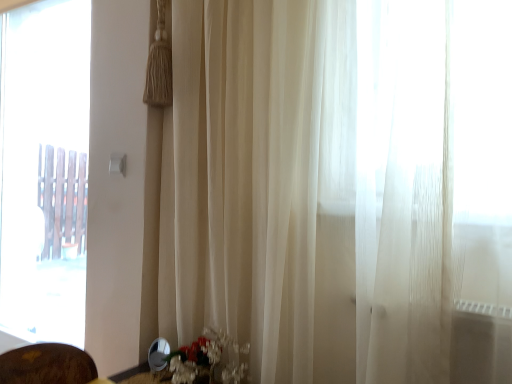
Question: From a real-world perspective, is transparent glass window at left positioned above or below translucent glass vase at lower center?

Choices:
 (A) above
 (B) below

Answer: (A)

Question: In terms of width, does transparent glass window at left look wider or thinner when compared to translucent glass vase at lower center?

Choices:
 (A) wide
 (B) thin

Answer: (B)

Question: Is transparent glass window at left taller or shorter than translucent glass vase at lower center?

Choices:
 (A) tall
 (B) short

Answer: (A)

Question: Looking at their shapes, would you say translucent glass vase at lower center is wider or thinner than transparent glass window at left?

Choices:
 (A) thin
 (B) wide

Answer: (B)

Question: Considering the relative positions of translucent glass vase at lower center and transparent glass window at left in the image provided, is translucent glass vase at lower center to the left or to the right of transparent glass window at left?

Choices:
 (A) right
 (B) left

Answer: (A)

Question: From the image's perspective, is translucent glass vase at lower center above or below transparent glass window at left?

Choices:
 (A) above
 (B) below

Answer: (B)

Question: Is translucent glass vase at lower center taller or shorter than transparent glass window at left?

Choices:
 (A) tall
 (B) short

Answer: (B)